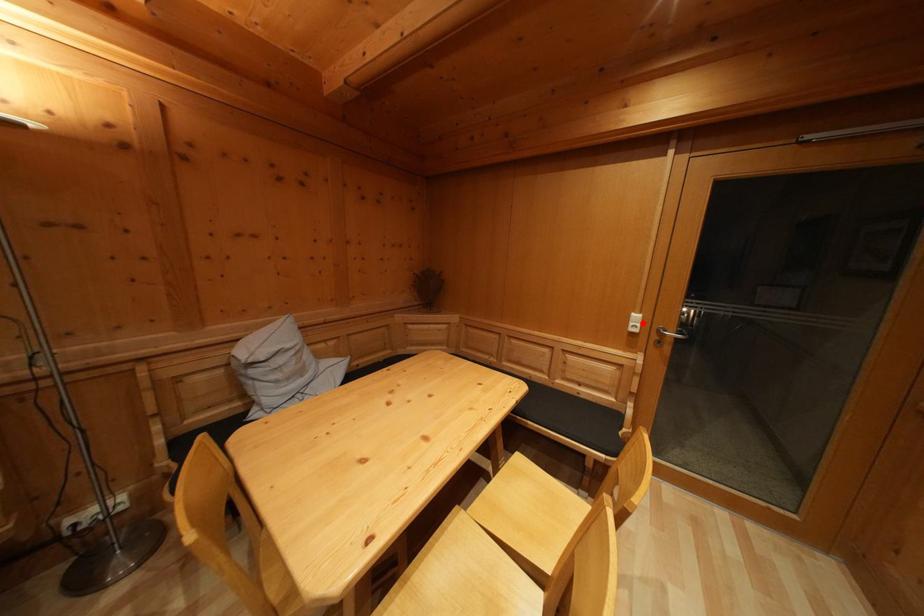
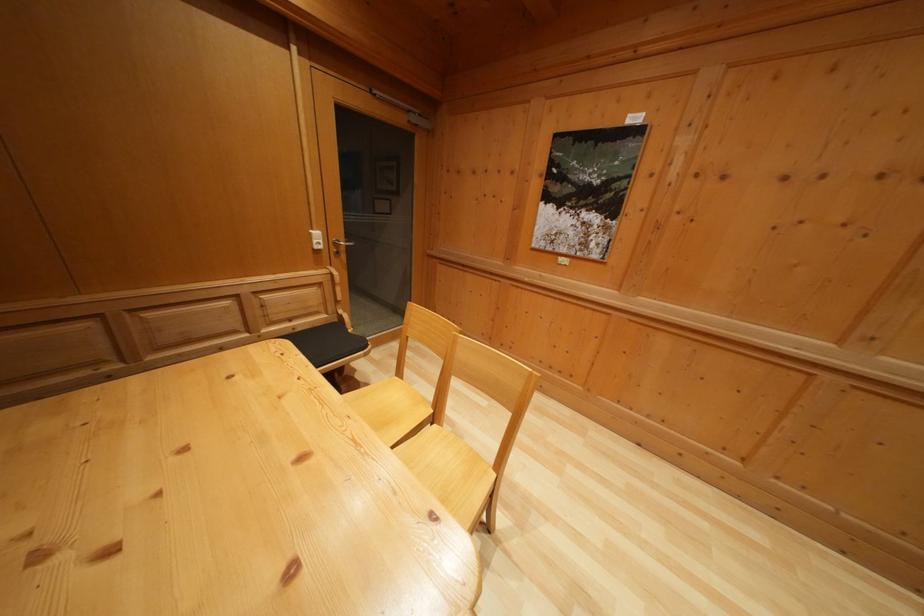
Locate, in the second image, the point that corresponds to the highlighted location in the first image.

(322, 240)